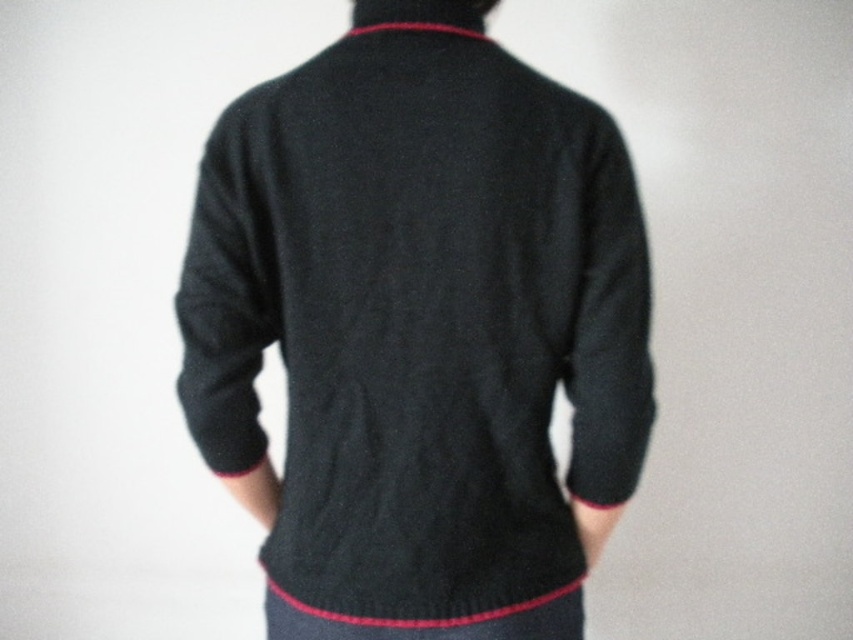
Measure the distance from dark gray wool sweater at center to red knitted neckband at center.

They are 33.80 centimeters apart.

Does dark gray wool sweater at center have a lesser width compared to red knitted neckband at center?

Incorrect, dark gray wool sweater at center's width is not less than red knitted neckband at center's.

This screenshot has width=853, height=640. What do you see at coordinates (419, 337) in the screenshot?
I see `dark gray wool sweater at center` at bounding box center [419, 337].

The width and height of the screenshot is (853, 640). Find the location of `dark gray wool sweater at center`. dark gray wool sweater at center is located at coordinates (419, 337).